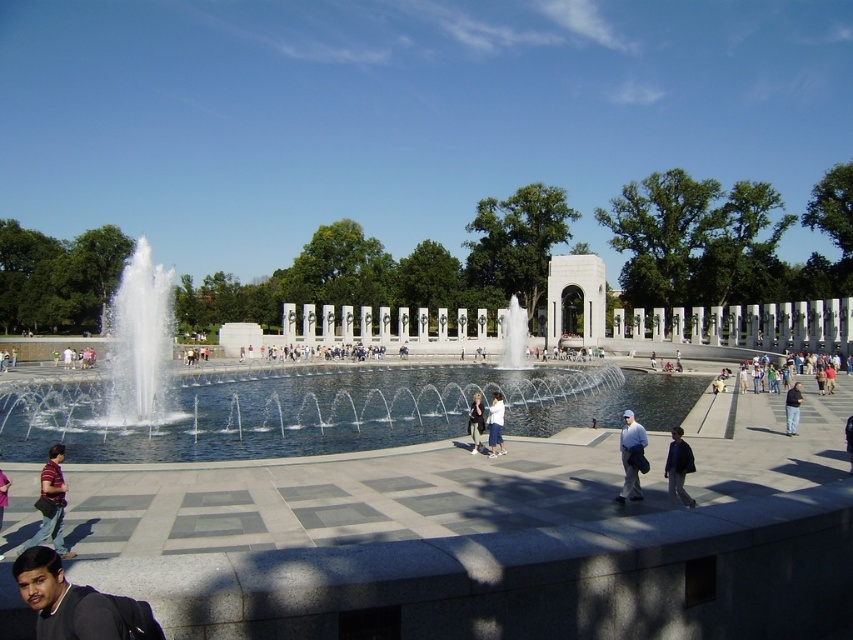
Question: Which is farther from the dark blue jacket at center?

Choices:
 (A) matte white shirt at center
 (B) dark gray sweater at lower left
 (C) light blue denim jacket at center

Answer: (B)

Question: Where is matte white shirt at center located in relation to denim jacket at center in the image?

Choices:
 (A) right
 (B) left

Answer: (A)

Question: Which point is closer to the camera?

Choices:
 (A) dark blue jeans at center
 (B) matte purple shirt at lower left
 (C) dark gray sweater at lower left
 (D) striped cotton shirt at lower left

Answer: (C)

Question: Considering the relative positions of striped cotton shirt at lower left and matte purple shirt at lower left in the image provided, where is striped cotton shirt at lower left located with respect to matte purple shirt at lower left?

Choices:
 (A) left
 (B) right

Answer: (B)

Question: Where is dark blue jacket at center located in relation to dark blue jeans at center in the image?

Choices:
 (A) below
 (B) above

Answer: (A)

Question: Which object is positioned closest to the dark blue jeans at center?

Choices:
 (A) light blue denim jacket at center
 (B) striped cotton shirt at lower left

Answer: (A)